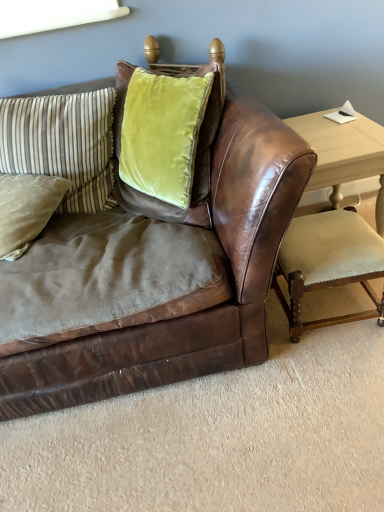
Question: Is light wood table at right thinner than velvet green pillow at upper left, the 2th pillow from the bottom?

Choices:
 (A) no
 (B) yes

Answer: (A)

Question: From the image's perspective, is light wood table at right located above velvet green pillow at upper left, the 2th pillow from the bottom?

Choices:
 (A) yes
 (B) no

Answer: (B)

Question: Can you confirm if light wood table at right is positioned to the left of velvet green pillow at upper left, the 2th pillow from the bottom?

Choices:
 (A) yes
 (B) no

Answer: (B)

Question: Is light wood table at right bigger than velvet green pillow at upper left, the first pillow when ordered from top to bottom?

Choices:
 (A) yes
 (B) no

Answer: (A)

Question: Is light wood table at right wider than velvet green pillow at upper left, the first pillow when ordered from top to bottom?

Choices:
 (A) yes
 (B) no

Answer: (A)

Question: Is light wood table at right smaller than velvet green pillow at upper left, the 2th pillow from the bottom?

Choices:
 (A) yes
 (B) no

Answer: (B)

Question: From the image's perspective, does suede green pillow at left, acting as the first pillow starting from the bottom, appear higher than velvet green pillow at upper left, the first pillow when ordered from top to bottom?

Choices:
 (A) no
 (B) yes

Answer: (A)

Question: Would you say suede green pillow at left, acting as the first pillow starting from the bottom, is a long distance from velvet green pillow at upper left, the first pillow when ordered from top to bottom?

Choices:
 (A) no
 (B) yes

Answer: (A)

Question: Is suede green pillow at left, acting as the first pillow starting from the bottom, taller than velvet green pillow at upper left, the 2th pillow from the bottom?

Choices:
 (A) no
 (B) yes

Answer: (A)

Question: Is suede green pillow at left, acting as the first pillow starting from the bottom, oriented away from velvet green pillow at upper left, the 2th pillow from the bottom?

Choices:
 (A) no
 (B) yes

Answer: (B)

Question: Considering the relative positions of suede green pillow at left, acting as the first pillow starting from the bottom, and velvet green pillow at upper left, the 2th pillow from the bottom, in the image provided, is suede green pillow at left, acting as the first pillow starting from the bottom, to the left of velvet green pillow at upper left, the 2th pillow from the bottom, from the viewer's perspective?

Choices:
 (A) no
 (B) yes

Answer: (B)

Question: From a real-world perspective, is suede green pillow at left, which is counted as the 2th pillow, starting from the top, positioned under velvet green pillow at upper left, the first pillow when ordered from top to bottom, based on gravity?

Choices:
 (A) no
 (B) yes

Answer: (B)

Question: Is the position of light wood table at right more distant than that of velvet beige armchair at lower right?

Choices:
 (A) no
 (B) yes

Answer: (B)